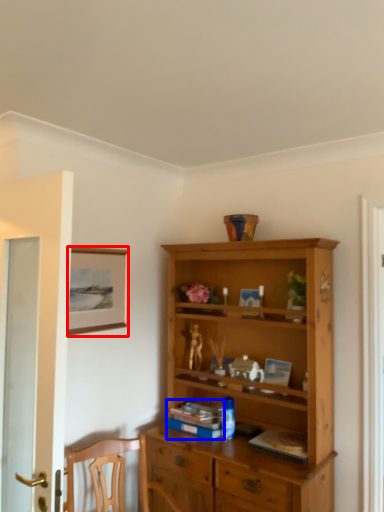
Question: Which object is closer to the camera taking this photo, picture frame (highlighted by a red box) or book (highlighted by a blue box)?

Choices:
 (A) picture frame
 (B) book

Answer: (A)